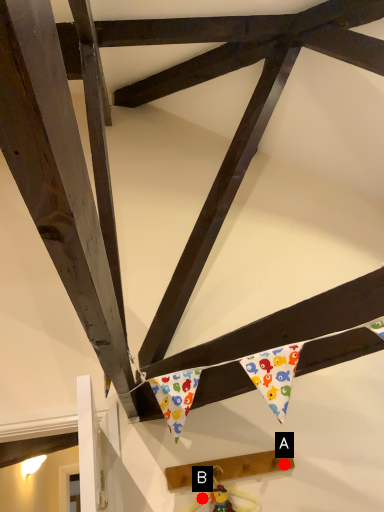
Question: Two points are circled on the image, labeled by A and B beside each circle. Which point is further to the camera?

Choices:
 (A) A is further
 (B) B is further

Answer: (A)